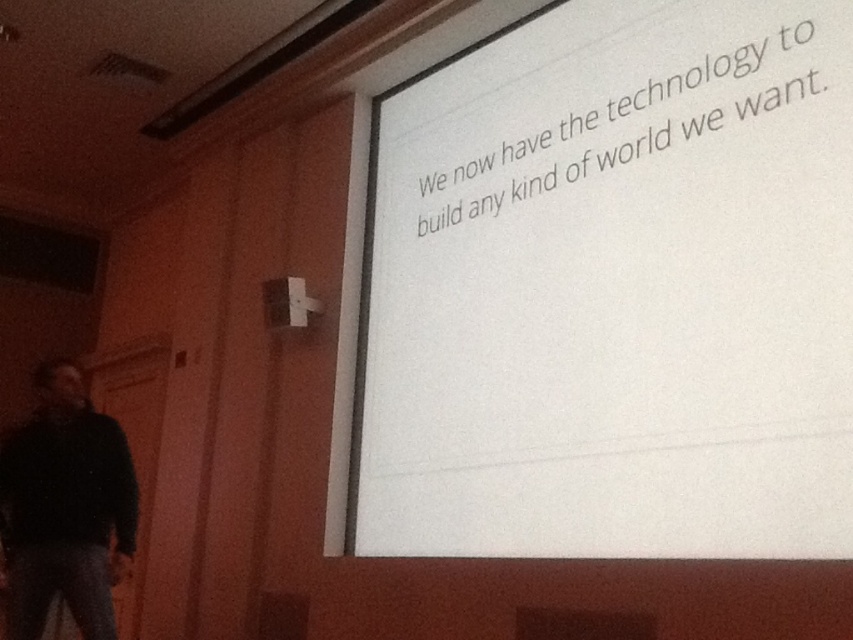
Question: Considering the relative positions of white paper at upper center and black matte jacket at lower left in the image provided, where is white paper at upper center located with respect to black matte jacket at lower left?

Choices:
 (A) right
 (B) left

Answer: (A)

Question: Is white paper at upper center further to camera compared to black matte jacket at lower left?

Choices:
 (A) yes
 (B) no

Answer: (B)

Question: Does white paper at upper center have a larger size compared to black matte jacket at lower left?

Choices:
 (A) no
 (B) yes

Answer: (B)

Question: Which of the following is the farthest from the observer?

Choices:
 (A) white paper at upper center
 (B) black matte jacket at lower left

Answer: (B)

Question: Which point is farther from the camera taking this photo?

Choices:
 (A) (636, 525)
 (B) (76, 518)

Answer: (B)

Question: Which object appears farthest from the camera in this image?

Choices:
 (A) black matte jacket at lower left
 (B) white paper at upper center

Answer: (A)